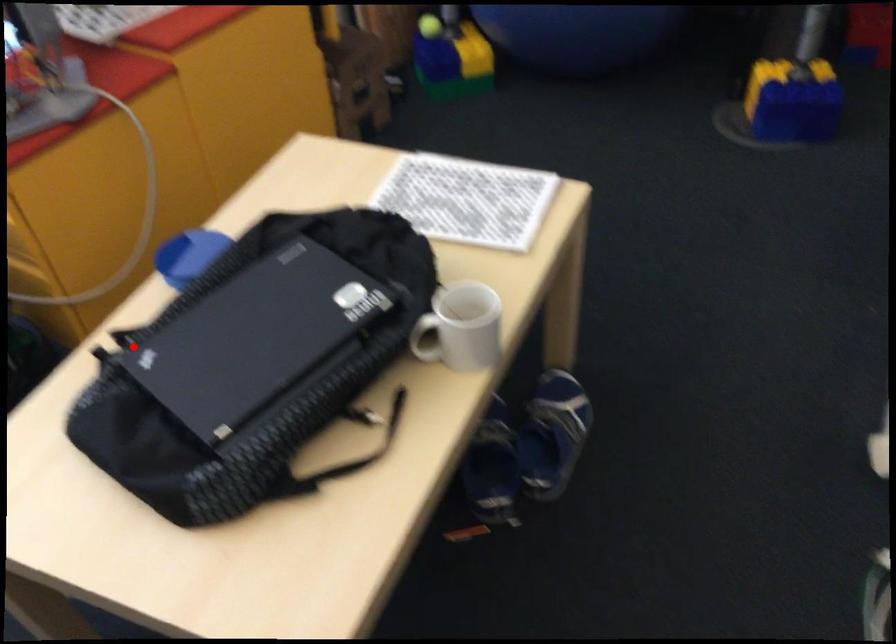
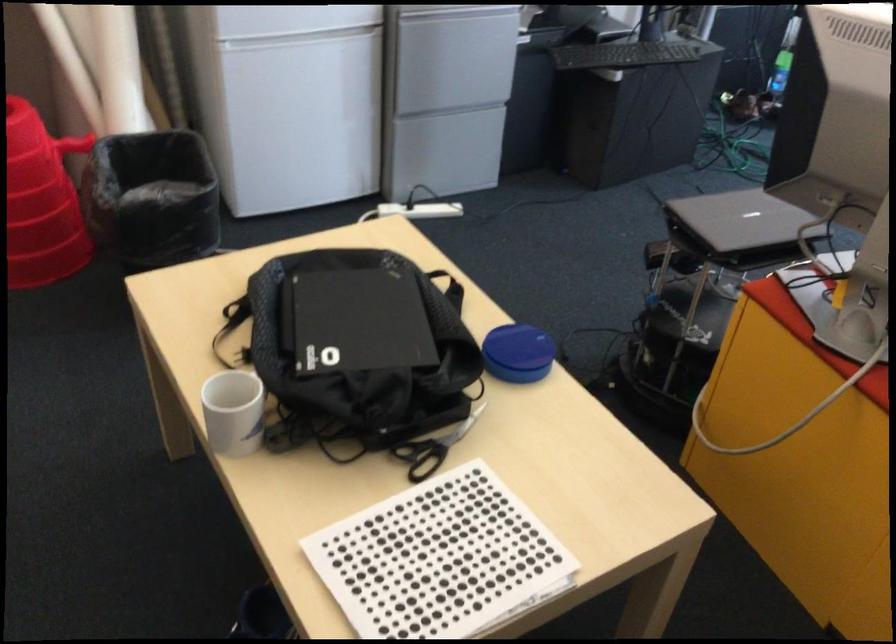
In the second image, find the point that corresponds to the highlighted location in the first image.

(450, 289)